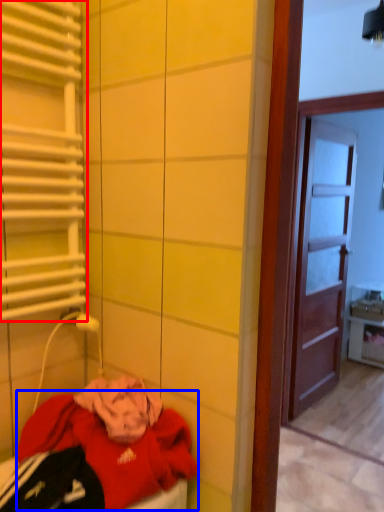
Question: Which object appears closest to the camera in this image, shutter (highlighted by a red box) or clothing (highlighted by a blue box)?

Choices:
 (A) shutter
 (B) clothing

Answer: (B)